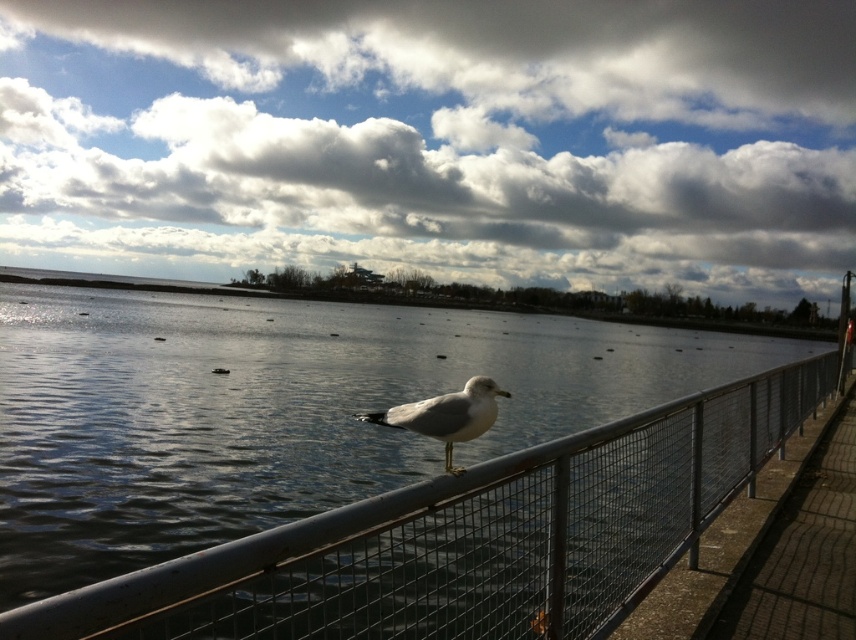
You are a photographer standing at the waterfront scene. You want to capture a photo where both the white fluffy cloud at upper center and the white matte bird at center are in focus. Which object should you focus on first to ensure both are sharp?

You should focus on the white fluffy cloud at upper center first because it is closer to you than the white matte bird at center, ensuring both will be in focus when using depth of field appropriately.

You are standing on the waterfront and want to take a photo of the white fluffy cloud at upper center and the metallic gray fence at center. Which object will appear larger in the photo?

The white fluffy cloud at upper center will appear larger in the photo because it is much taller than the metallic gray fence at center.

You are an astronomer analyzing the position of celestial objects in the image. Given that the white fluffy cloud at upper center is at coordinates 0.217 on the x and 0.509 on the y axis, can you determine if it is positioned to the left or right of the center of the image?

The white fluffy cloud at upper center is located at point 0.217 on the x axis and 0.509 on the y axis. Since the x coordinate is less than 0.5, it is positioned to the left of the center of the image.